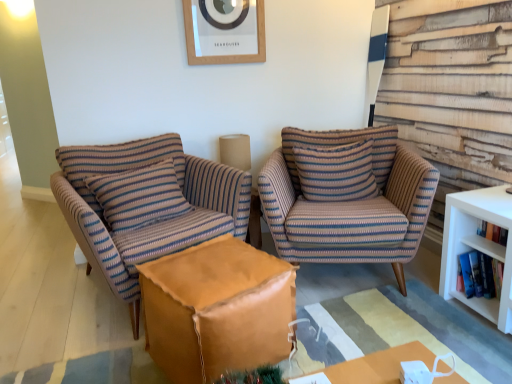
Question: Considering the positions of point (x=247, y=349) and point (x=303, y=185), is point (x=247, y=349) closer or farther from the camera than point (x=303, y=185)?

Choices:
 (A) closer
 (B) farther

Answer: (A)

Question: Is leather ottoman at center wider or thinner than striped fabric pillow at center, the 1th pillow from the right?

Choices:
 (A) thin
 (B) wide

Answer: (B)

Question: Based on their relative distances, which object is farther from the hardcover book at right, arranged as the 2th book when ordered from the bottom?

Choices:
 (A) white paperbacks at right, positioned as the 1th book in bottom-to-top order
 (B) striped fabric pillow at left, which appears as the second pillow when viewed from the right
 (C) striped fabric armchair at left, marked as the second chair in a right-to-left arrangement
 (D) striped fabric armchair at center, which is the second chair in left-to-right order
 (E) striped fabric pillow at center, the 2th pillow in the left-to-right sequence

Answer: (B)

Question: Based on their relative distances, which object is nearer to the wooden picture frame at upper center?

Choices:
 (A) striped fabric pillow at left, which is the first pillow in left-to-right order
 (B) hardcover book at right, arranged as the 2th book when ordered from the bottom
 (C) white paperbacks at right, positioned as the 1th book in bottom-to-top order
 (D) striped fabric pillow at center, the 2th pillow in the left-to-right sequence
 (E) striped fabric armchair at center, which is the second chair in left-to-right order

Answer: (D)